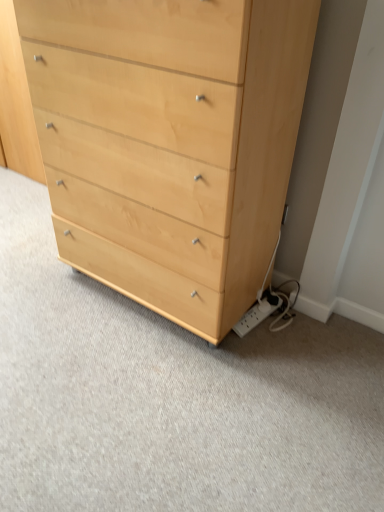
Question: Would you say white plastic power strip at lower right is inside or outside light wood chest of drawers at center?

Choices:
 (A) inside
 (B) outside

Answer: (B)

Question: In the image, is white plastic power strip at lower right positioned in front of or behind light wood chest of drawers at center?

Choices:
 (A) behind
 (B) front

Answer: (A)

Question: Considering the positions of point (269, 307) and point (74, 225), is point (269, 307) closer or farther from the camera than point (74, 225)?

Choices:
 (A) closer
 (B) farther

Answer: (B)

Question: Considering the positions of light wood chest of drawers at center and white plastic power strip at lower right in the image, is light wood chest of drawers at center wider or thinner than white plastic power strip at lower right?

Choices:
 (A) thin
 (B) wide

Answer: (B)

Question: In terms of size, does light wood chest of drawers at center appear bigger or smaller than white plastic power strip at lower right?

Choices:
 (A) small
 (B) big

Answer: (B)

Question: Is point (155, 108) positioned closer to the camera than point (274, 309)?

Choices:
 (A) closer
 (B) farther

Answer: (A)

Question: Is light wood chest of drawers at center taller or shorter than white plastic power strip at lower right?

Choices:
 (A) tall
 (B) short

Answer: (A)